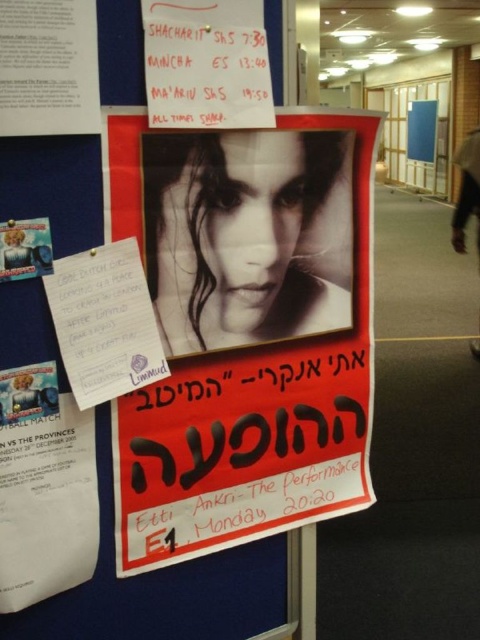
You are an event planner who needs to hang two posters on a wall. You have a matte paper poster at center and a matte paper poster at upper center. The wall space you have is limited in height. Which poster should you choose to hang if you want to maximize the use of the available height?

The matte paper poster at center is much taller than the matte paper poster at upper center, so you should choose the matte paper poster at center to maximize the use of the available height.

You are standing 30 inches away from the bulletin board. Can you reach the point at coordinates point (255, 92) on the board?

The distance of point (255, 92) from camera is 31.99 inches. Since you are standing 30 inches away from the board, the point is 1.99 inches further away than your current position, so you cannot reach it.

You are an event planner looking at the bulletin board. You see the matte paper poster at upper center and the matte paper poster at upper left. Which poster is positioned to the right side of the bulletin board?

The matte paper poster at upper center is positioned to the right of the matte paper poster at upper left, so the matte paper poster at upper center is the one on the right side of the bulletin board.